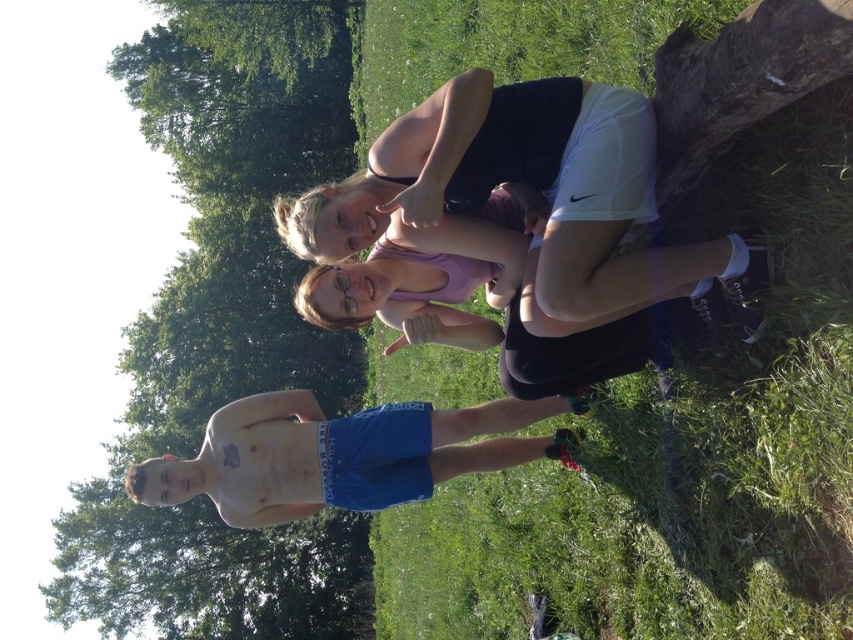
You are a photographer trying to capture a photo of the green grass at upper right and the matte black tank top at upper center. Which object is located to the left of the other?

The green grass at upper right is positioned on the left side of matte black tank top at upper center.

You are standing in the grassy area and want to take a photo of the green leafy tree at upper center and the green grass at upper right. Which object should you point your camera towards first if you want to capture both in a single frame?

You should point your camera towards the green leafy tree at upper center first because it is to the left of the green grass at upper right, allowing both to be captured in the frame.

You are a photographer trying to capture a group shot of the matte black tank top at upper center and the pink fabric at center. The camera you are using has a minimum focus distance of 2 meters. Will you be able to focus on both subjects simultaneously?

The matte black tank top at upper center and pink fabric at center are 2.15 meters apart from each other. Since the minimum focus distance is 2 meters, the camera can focus on both subjects as they are within the required distance.